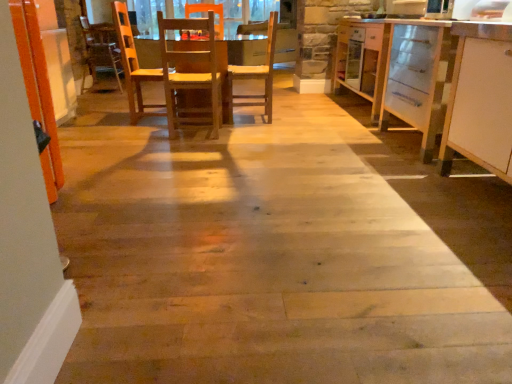
Question: From the image's perspective, is wooden chair at center, the second chair from the right, under white matte cabinet at right?

Choices:
 (A) no
 (B) yes

Answer: (A)

Question: Are wooden chair at center, the second chair from the right, and white matte cabinet at right located far from each other?

Choices:
 (A) no
 (B) yes

Answer: (B)

Question: From a real-world perspective, does wooden chair at center, the second chair from the right, sit lower than white matte cabinet at right?

Choices:
 (A) yes
 (B) no

Answer: (A)

Question: Is wooden chair at center, marked as the 1th chair in a left-to-right arrangement, to the right of white matte cabinet at right from the viewer's perspective?

Choices:
 (A) yes
 (B) no

Answer: (B)

Question: Is wooden chair at center, marked as the 1th chair in a left-to-right arrangement, next to white matte cabinet at right?

Choices:
 (A) yes
 (B) no

Answer: (B)

Question: Based on their positions, is white matte cabinet at right located to the left or right of wooden chair at center, which is counted as the 1th chair, starting from the right?

Choices:
 (A) right
 (B) left

Answer: (A)

Question: Do you think white matte cabinet at right is within wooden chair at center, which is counted as the 1th chair, starting from the right, or outside of it?

Choices:
 (A) outside
 (B) inside

Answer: (A)

Question: From the image's perspective, is white matte cabinet at right above or below wooden chair at center, which is counted as the 1th chair, starting from the right?

Choices:
 (A) below
 (B) above

Answer: (A)

Question: Considering the positions of white matte cabinet at right and wooden chair at center, the 2th chair in the left-to-right sequence, in the image, is white matte cabinet at right bigger or smaller than wooden chair at center, the 2th chair in the left-to-right sequence,?

Choices:
 (A) small
 (B) big

Answer: (B)

Question: Is wooden chair at center, which is counted as the 1th chair, starting from the right, to the left or to the right of wooden chair at center, marked as the 1th chair in a left-to-right arrangement, in the image?

Choices:
 (A) right
 (B) left

Answer: (A)

Question: Is wooden chair at center, the 2th chair in the left-to-right sequence, inside or outside of wooden chair at center, marked as the 1th chair in a left-to-right arrangement?

Choices:
 (A) outside
 (B) inside

Answer: (A)

Question: Considering the positions of wooden chair at center, the 2th chair in the left-to-right sequence, and wooden chair at center, the second chair from the right, in the image, is wooden chair at center, the 2th chair in the left-to-right sequence, bigger or smaller than wooden chair at center, the second chair from the right,?

Choices:
 (A) small
 (B) big

Answer: (A)

Question: Relative to wooden chair at center, marked as the 1th chair in a left-to-right arrangement, is wooden chair at center, which is counted as the 1th chair, starting from the right, in front or behind?

Choices:
 (A) front
 (B) behind

Answer: (B)

Question: Considering the positions of wooden chair at center, marked as the 1th chair in a left-to-right arrangement, and wooden table at center in the image, is wooden chair at center, marked as the 1th chair in a left-to-right arrangement, taller or shorter than wooden table at center?

Choices:
 (A) short
 (B) tall

Answer: (B)

Question: Is wooden chair at center, marked as the 1th chair in a left-to-right arrangement, inside or outside of wooden table at center?

Choices:
 (A) inside
 (B) outside

Answer: (A)